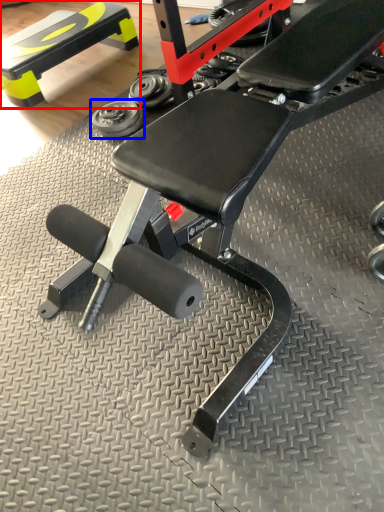
Question: Which point is further to the camera, bench (highlighted by a red box) or dumbbell (highlighted by a blue box)?

Choices:
 (A) bench
 (B) dumbbell

Answer: (A)